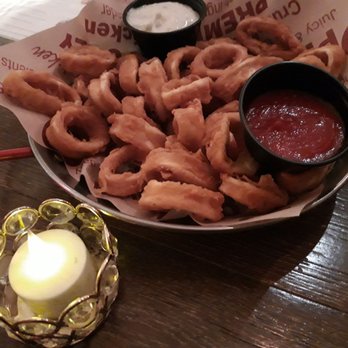
Find the location of a particular element. The width and height of the screenshot is (348, 348). silver bowl is located at coordinates (139, 222).